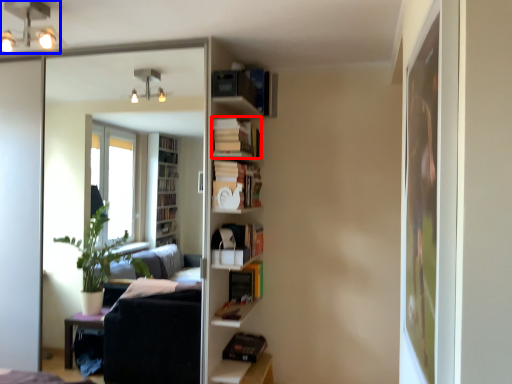
Question: Which of the following is the farthest to the observer, book (highlighted by a red box) or light fixture (highlighted by a blue box)?

Choices:
 (A) book
 (B) light fixture

Answer: (A)